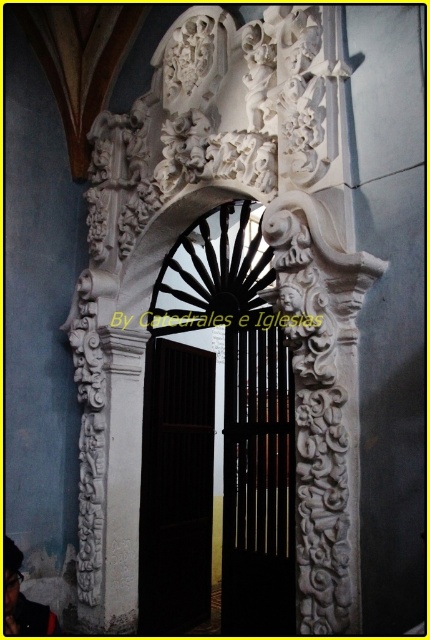
In the scene shown: Can you confirm if white carved wood door at center is bigger than dark wood door at center?

Yes.

Is point (272, 400) positioned after point (183, 600)?

That is False.

The height and width of the screenshot is (640, 430). I want to click on white carved wood door at center, so click(x=214, y=436).

Is white carved wood door at center to the right of black polished wood door at center from the viewer's perspective?

No, white carved wood door at center is not to the right of black polished wood door at center.

Between white carved wood door at center and black polished wood door at center, which one appears on the left side from the viewer's perspective?

white carved wood door at center is more to the left.

Is point (149, 452) positioned behind point (230, 570)?

Yes.

Locate an element on the screen. The width and height of the screenshot is (430, 640). white carved wood door at center is located at coordinates (214, 436).

Measure the distance from black polished wood door at center to dark wood door at center.

The distance of black polished wood door at center from dark wood door at center is 32.02 inches.

Can you confirm if black polished wood door at center is thinner than dark wood door at center?

Yes, black polished wood door at center is thinner than dark wood door at center.

This screenshot has width=430, height=640. What do you see at coordinates (258, 481) in the screenshot?
I see `black polished wood door at center` at bounding box center [258, 481].

Where is `black polished wood door at center`? black polished wood door at center is located at coordinates (258, 481).